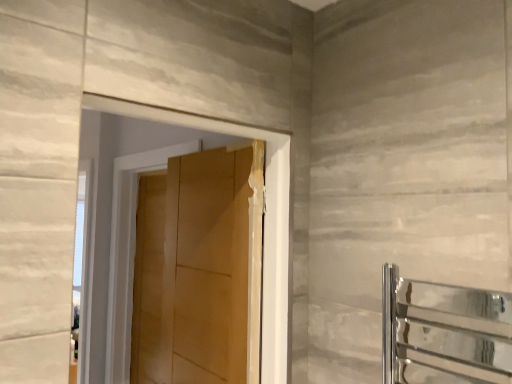
What do you see at coordinates (208, 265) in the screenshot?
I see `light brown wood door at center` at bounding box center [208, 265].

Locate an element on the screen. This screenshot has height=384, width=512. light brown wood door at center is located at coordinates pyautogui.click(x=208, y=265).

Locate an element on the screen. This screenshot has width=512, height=384. light brown wood door at center is located at coordinates (208, 265).